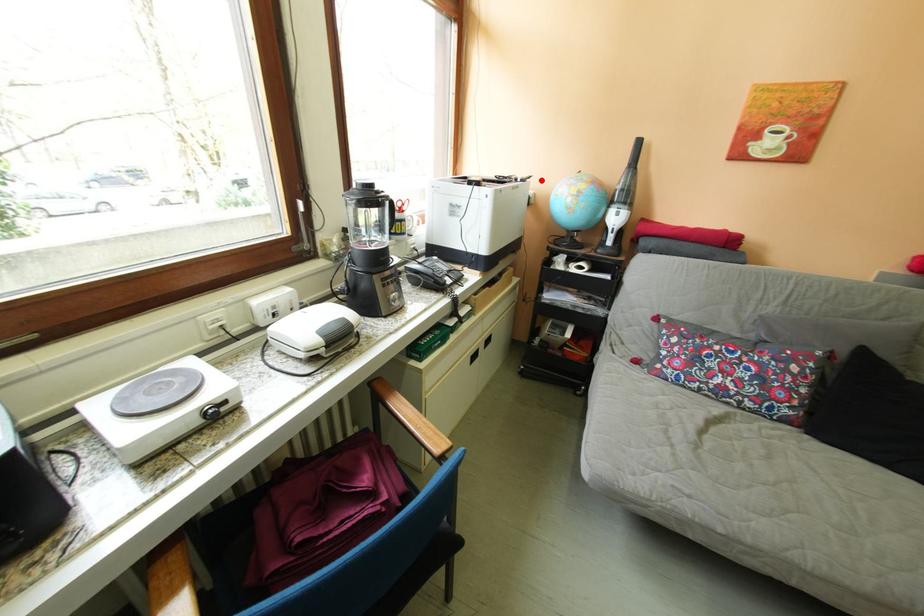
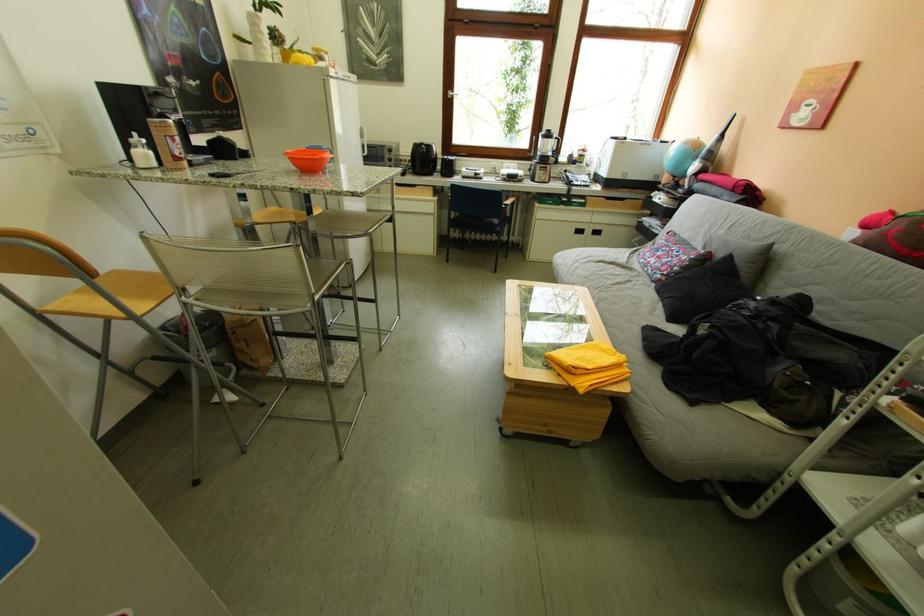
In the second image, find the point that corresponds to the highlighted location in the first image.

(687, 145)